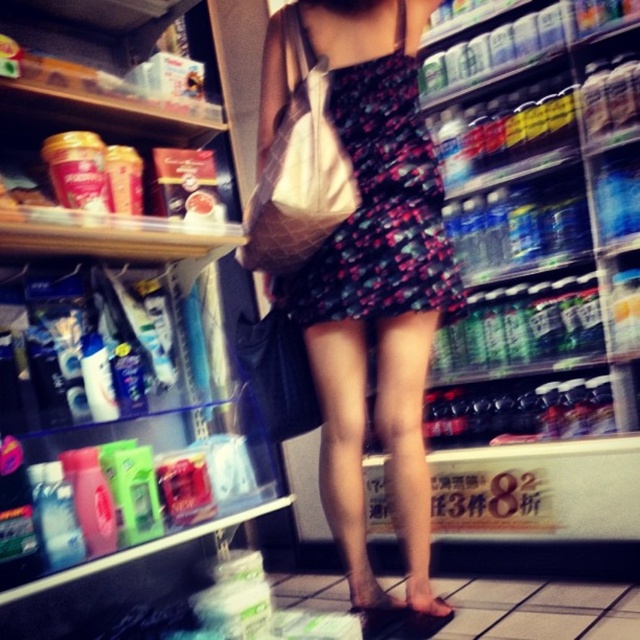
Question: Is floral-patterned fabric dress at center bigger than brown leather sandal at lower center?

Choices:
 (A) yes
 (B) no

Answer: (A)

Question: From the image, what is the correct spatial relationship of floral-patterned fabric dress at center in relation to matte black sandal at lower center?

Choices:
 (A) left
 (B) right

Answer: (A)

Question: Which object is farther from the camera taking this photo?

Choices:
 (A) matte black sandal at lower center
 (B) brown leather sandal at lower center
 (C) floral dress at center
 (D) translucent plastic bottles at left

Answer: (B)

Question: Which object is closer to the camera taking this photo?

Choices:
 (A) floral-patterned fabric dress at center
 (B) matte black sandal at lower center
 (C) floral dress at center
 (D) brown leather sandal at lower center

Answer: (A)

Question: Considering the relative positions of translucent plastic bottles at left and matte black sandal at lower center in the image provided, where is translucent plastic bottles at left located with respect to matte black sandal at lower center?

Choices:
 (A) right
 (B) left

Answer: (B)

Question: Among these objects, which one is nearest to the camera?

Choices:
 (A) floral dress at center
 (B) brown leather sandal at lower center
 (C) matte black sandal at lower center
 (D) translucent plastic bottles at left

Answer: (D)